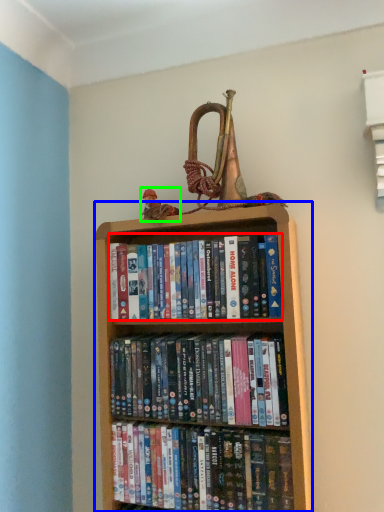
Question: Which object is positioned farthest from book (highlighted by a red box)? Select from bookcase (highlighted by a blue box) and toy (highlighted by a green box).

Choices:
 (A) bookcase
 (B) toy

Answer: (B)